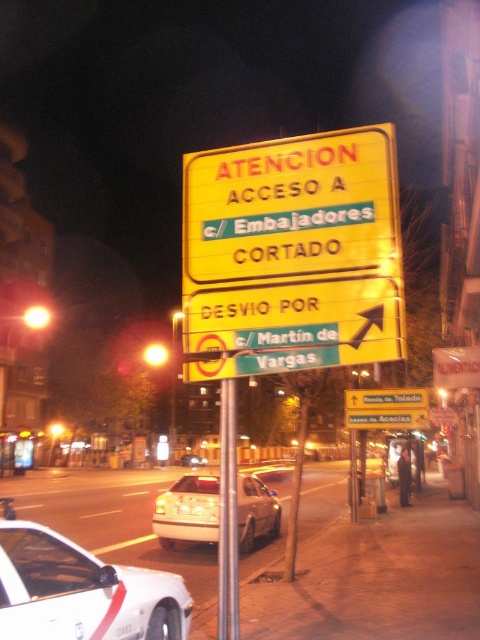
Is yellow plastic sign at center shorter than silver metallic car at center?

Indeed, yellow plastic sign at center has a lesser height compared to silver metallic car at center.

Can you confirm if yellow plastic sign at center is positioned above silver metallic car at center?

Yes, yellow plastic sign at center is above silver metallic car at center.

Is point (369, 417) farther from camera compared to point (180, 465)?

No, (369, 417) is closer to viewer.

Identify the location of yellow plastic sign at center. The width and height of the screenshot is (480, 640). (386, 419).

Does white glossy car at lower left appear on the right side of white metallic sedan at center?

In fact, white glossy car at lower left is to the left of white metallic sedan at center.

Who is more distant from viewer, (8,616) or (169,529)?

Positioned behind is point (169,529).

Which is behind, point (12, 634) or point (186, 516)?

Point (186, 516)

Locate an element on the screen. The image size is (480, 640). white glossy car at lower left is located at coordinates (82, 592).

Which is more to the right, white metallic sedan at center or yellow matte sign at upper center?

yellow matte sign at upper center is more to the right.

This screenshot has width=480, height=640. In order to click on white metallic sedan at center in this screenshot , I will do `click(188, 509)`.